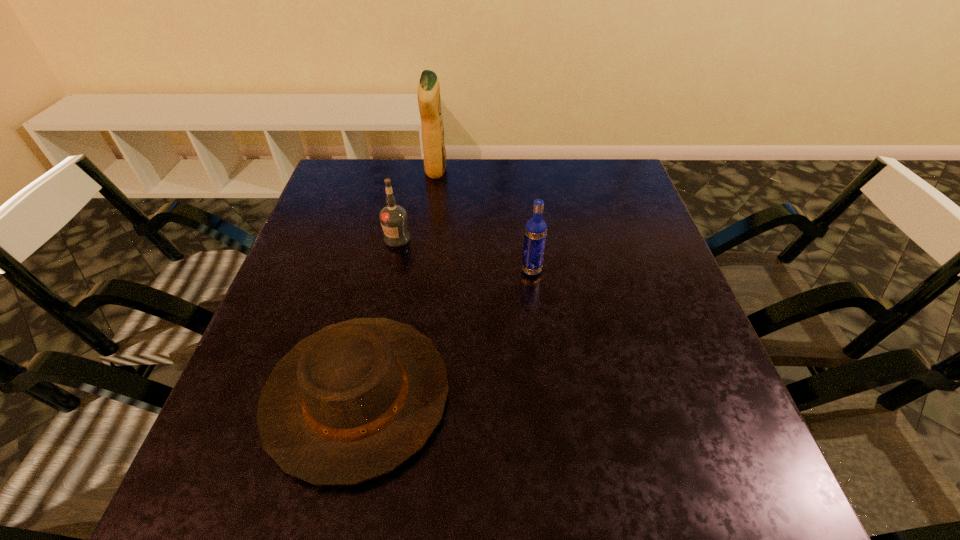
You are a GUI agent. You are given a task and a screenshot of the screen. Output one action in this format:
    pyautogui.click(x=<x>, y=<y>)
    Task: Click on the tallest object
    This screenshot has width=960, height=540.
    Given the screenshot: What is the action you would take?
    click(x=429, y=101)

I want to click on detergent, so click(x=429, y=101).

At what (x,y) coordinates should I click in order to perform the action: click on the rightmost object. Please return your answer as a coordinate pair (x, y). Looking at the image, I should click on (535, 230).

You are a GUI agent. You are given a task and a screenshot of the screen. Output one action in this format:
    pyautogui.click(x=<x>, y=<y>)
    Task: Click on the second nearest object
    This screenshot has height=540, width=960.
    Given the screenshot: What is the action you would take?
    pyautogui.click(x=535, y=230)

Image resolution: width=960 pixels, height=540 pixels. I want to click on the left vodka, so click(393, 218).

The height and width of the screenshot is (540, 960). I want to click on the second farthest object, so click(393, 218).

Image resolution: width=960 pixels, height=540 pixels. What are the coordinates of `the shortest object` in the screenshot? It's located at (353, 401).

Locate an element on the screen. Image resolution: width=960 pixels, height=540 pixels. cowboy hat is located at coordinates (353, 401).

The width and height of the screenshot is (960, 540). I want to click on vacant space situated 0.290m on the label of the tallest object, so click(543, 171).

Image resolution: width=960 pixels, height=540 pixels. In order to click on free point located 0.290m on the right of the right vodka in this screenshot , I will do `click(666, 271)`.